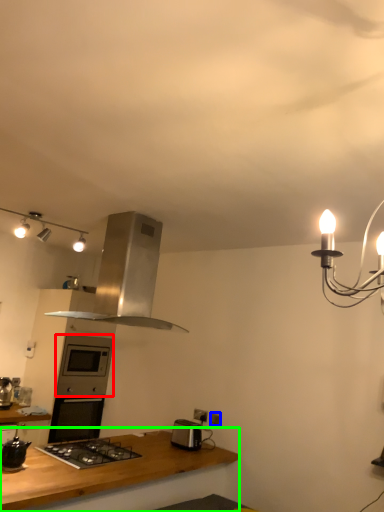
Question: Which object is positioned farthest from oven (highlighted by a red box)? Select from electric outlet (highlighted by a blue box) and countertop (highlighted by a green box).

Choices:
 (A) electric outlet
 (B) countertop

Answer: (A)